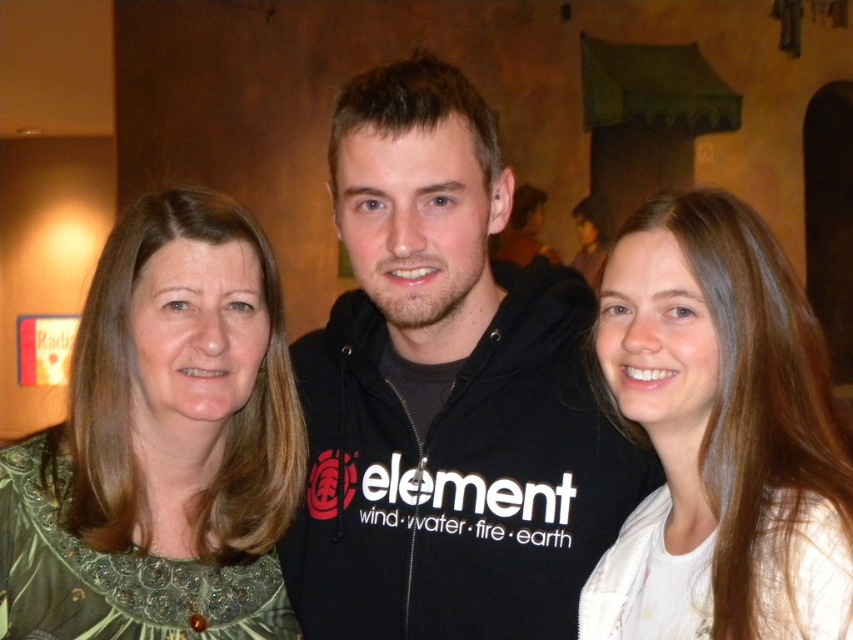
Question: Which of the following is the farthest from the observer?

Choices:
 (A) smooth white shirt at right
 (B) green sequined dress at left

Answer: (B)

Question: Is black hoodie at center below green sequined dress at left?

Choices:
 (A) no
 (B) yes

Answer: (A)

Question: Which object is positioned farthest from the green sequined dress at left?

Choices:
 (A) black hoodie at center
 (B) smooth white shirt at right

Answer: (B)

Question: Estimate the real-world distances between objects in this image. Which object is closer to the smooth white shirt at right?

Choices:
 (A) black hoodie at center
 (B) green sequined dress at left

Answer: (A)

Question: Can you confirm if black hoodie at center is positioned to the left of green sequined dress at left?

Choices:
 (A) no
 (B) yes

Answer: (A)

Question: Is green sequined dress at left to the right of smooth white shirt at right from the viewer's perspective?

Choices:
 (A) yes
 (B) no

Answer: (B)